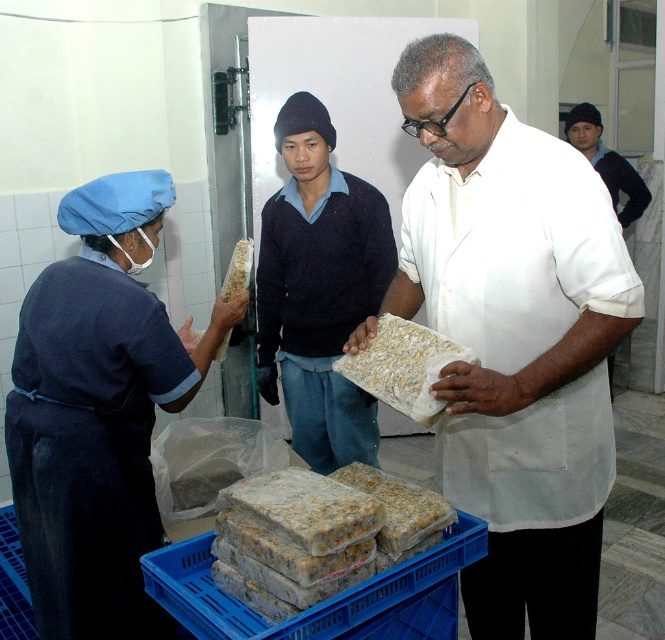
Question: Is blue fabric uniform at left positioned behind dark blue sweater at center?

Choices:
 (A) yes
 (B) no

Answer: (B)

Question: Which point is closer to the camera?

Choices:
 (A) dark blue sweater at center
 (B) white crumbly blocks at center

Answer: (B)

Question: Can you confirm if translucent plastic blocks at center is smaller than white matte shirt at center?

Choices:
 (A) no
 (B) yes

Answer: (B)

Question: Is black knit cap at upper right further to the viewer compared to white crumbly food at center?

Choices:
 (A) no
 (B) yes

Answer: (B)

Question: Which object is closer to the camera taking this photo?

Choices:
 (A) blue fabric uniform at left
 (B) white crumbly blocks at center

Answer: (B)

Question: Considering the real-world distances, which object is farthest from the white matte rectangular object at center?

Choices:
 (A) white matte shirt at center
 (B) black knit cap at upper right
 (C) translucent plastic blocks at center
 (D) white crumbly food at center

Answer: (B)